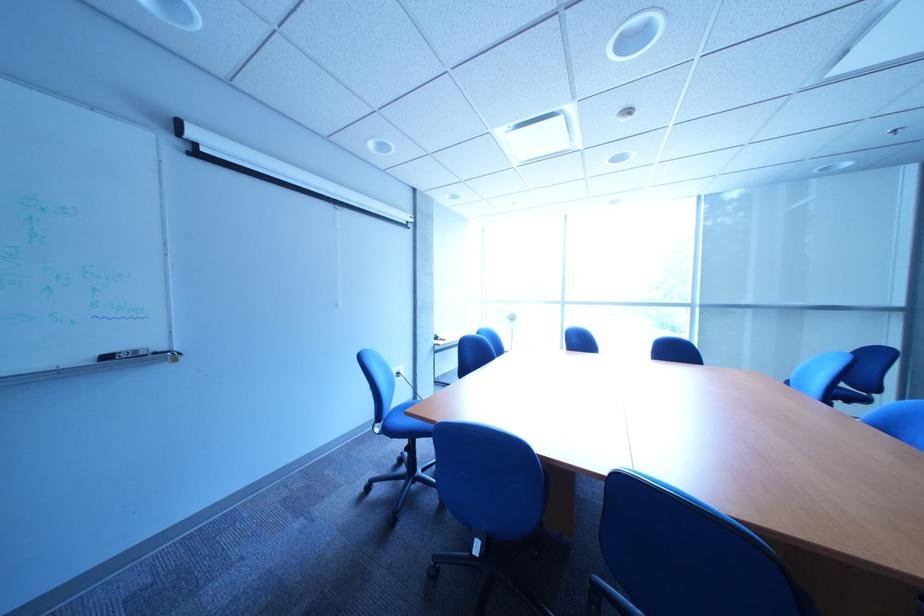
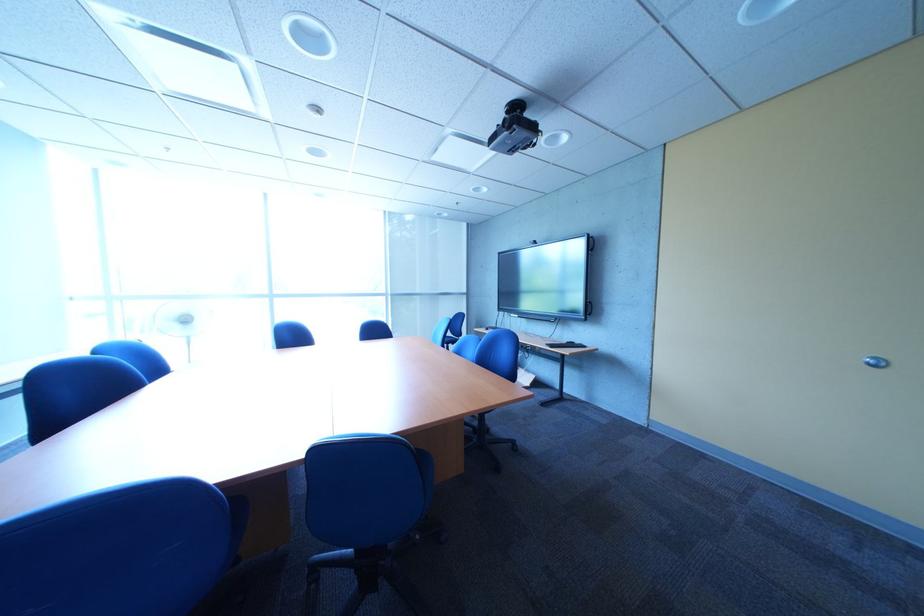
Question: The images are taken continuously from a first-person perspective. In which direction is your viewpoint rotating?

Choices:
 (A) Left
 (B) Right
 (C) Up
 (D) Down

Answer: (B)